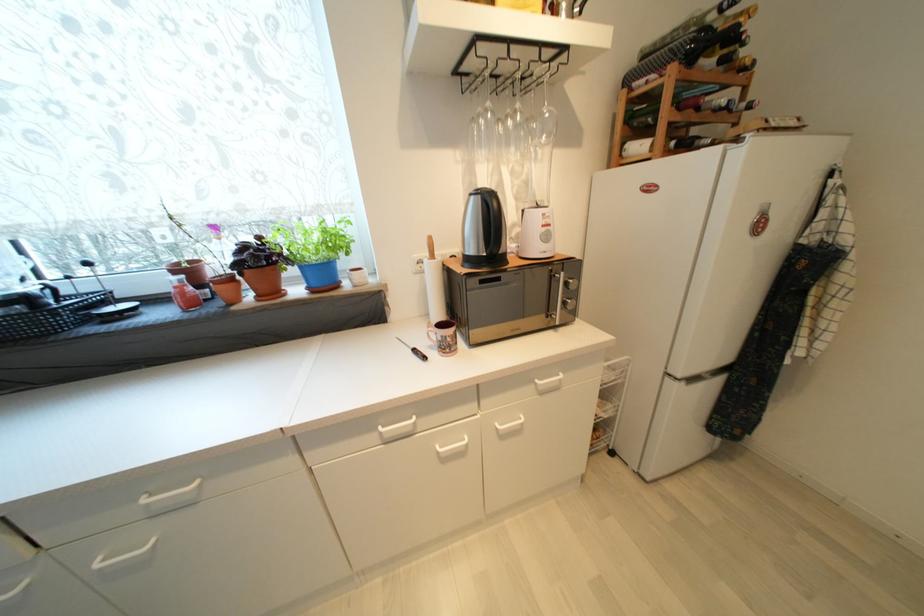
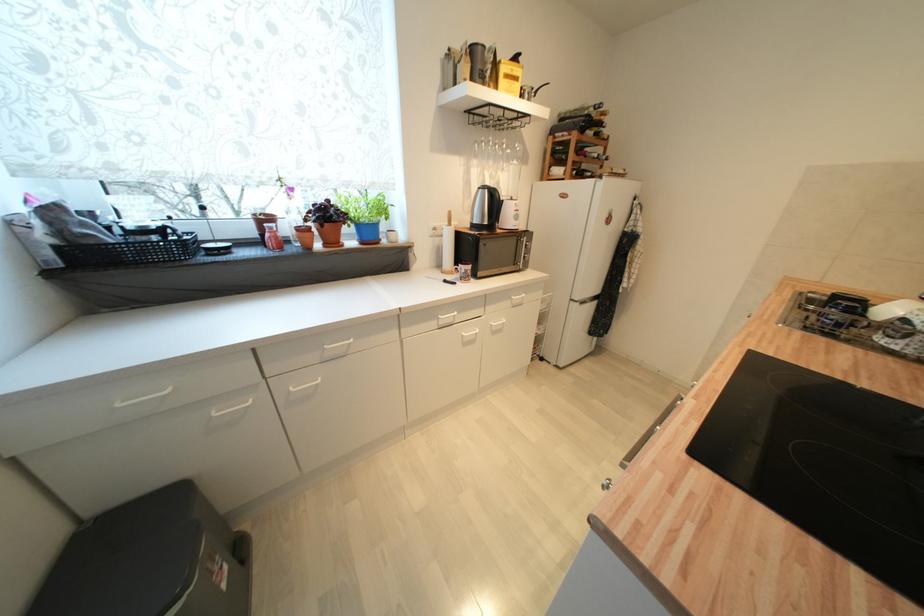
Find the pixel in the second image that matches point 482,193 in the first image.

(489, 188)